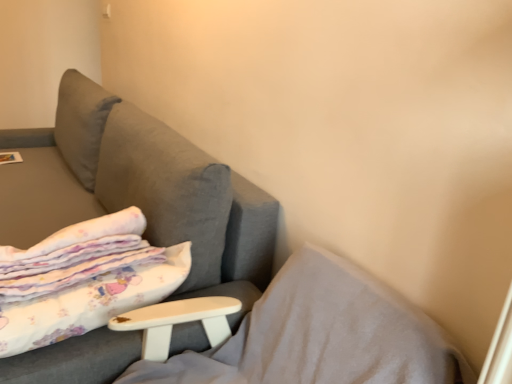
Question: Is white cotton blanket at left inside the boundaries of matte white magazine at upper left, or outside?

Choices:
 (A) inside
 (B) outside

Answer: (B)

Question: Relative to matte white magazine at upper left, is white cotton blanket at left in front or behind?

Choices:
 (A) behind
 (B) front

Answer: (B)

Question: Which of these objects is positioned closest to the white soft pillow at lower left?

Choices:
 (A) matte white magazine at upper left
 (B) white cotton blanket at left

Answer: (B)

Question: Considering the real-world distances, which object is farthest from the matte white magazine at upper left?

Choices:
 (A) white cotton blanket at left
 (B) white soft pillow at lower left

Answer: (B)